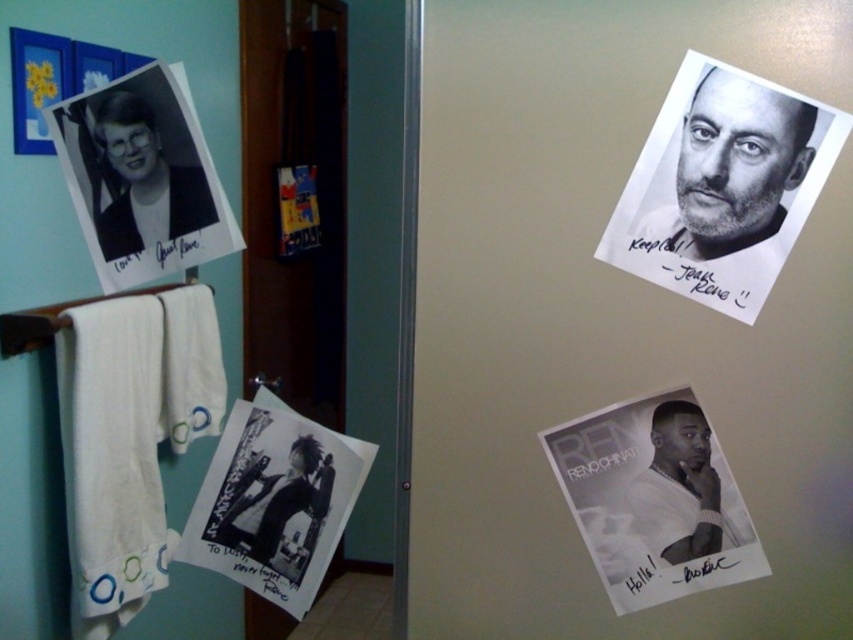
Does black paper at upper right come in front of matte black photo at left?

No, it is not.

Is point (751, 228) less distant than point (199, 172)?

That is False.

The image size is (853, 640). Find the location of `black paper at upper right`. black paper at upper right is located at coordinates (732, 168).

Who is more distant from viewer, (239, 564) or (306, 456)?

The point (239, 564) is behind.

Who is more forward, [236,554] or [305,474]?

Point [305,474]

At what (x,y) coordinates should I click in order to perform the action: click on black paper at center. Please return your answer as a coordinate pair (x, y). This screenshot has width=853, height=640. Looking at the image, I should click on (274, 500).

Does black paper at lower right appear on the right side of black paper at upper right?

In fact, black paper at lower right is to the left of black paper at upper right.

This screenshot has height=640, width=853. I want to click on black paper at lower right, so click(654, 499).